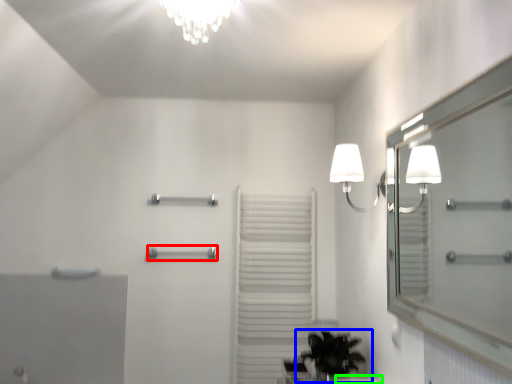
Question: Estimate the real-world distances between objects in this image. Which object is farther from towel bar (highlighted by a red box), houseplant (highlighted by a blue box) or counter top (highlighted by a green box)?

Choices:
 (A) houseplant
 (B) counter top

Answer: (B)